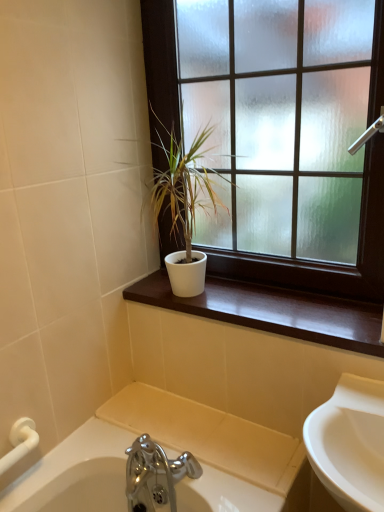
The image size is (384, 512). Find the location of `free spot below white matte pot at center (from a real-world perspective)`. free spot below white matte pot at center (from a real-world perspective) is located at coordinates 179,295.